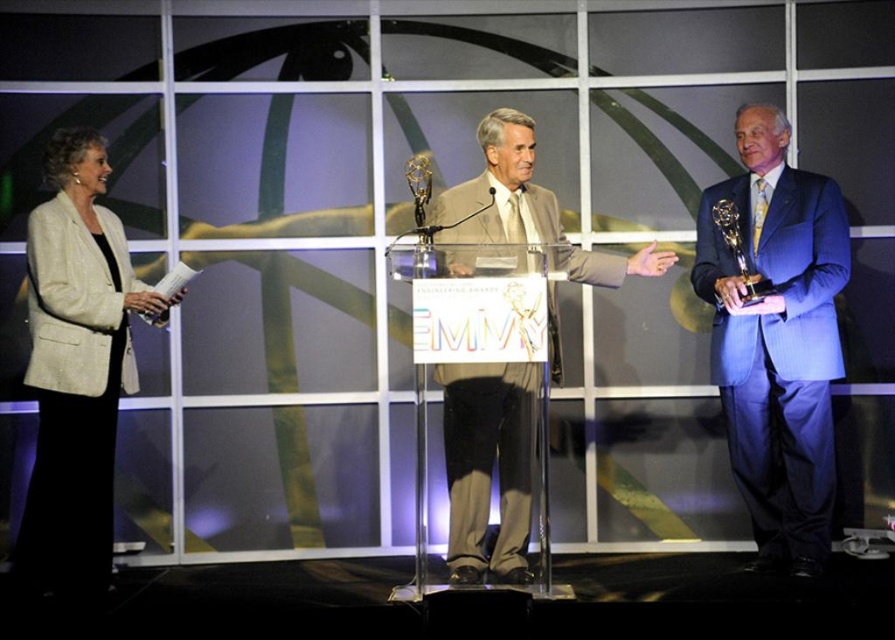
You are a photographer at the awards ceremony and need to capture a closeup shot of the blue pinstripe suit at right and the light beige fabric suit at center. Which suit will appear narrower in the photo?

The blue pinstripe suit at right is thinner than the light beige fabric suit at center, so it will appear narrower in the photo.

You are an event coordinator planning to place a decorative ribbon on the light beige fabric jacket at left. Where exactly should you place it based on the jacket location?

The light beige fabric jacket at left is located at point (77, 368), so place the ribbon at that coordinate to ensure it aligns correctly with the jacket.

You are a photographer positioned at the camera. You need to capture a closeup shot of the blue pinstripe suit at right. Given that your camera can focus on subjects within 3 meters, will you be able to take the closeup without moving closer?

The blue pinstripe suit at right is 3.52 meters away from the camera. Since the camera can only focus within 3 meters, you will need to move closer to take the closeup shot.